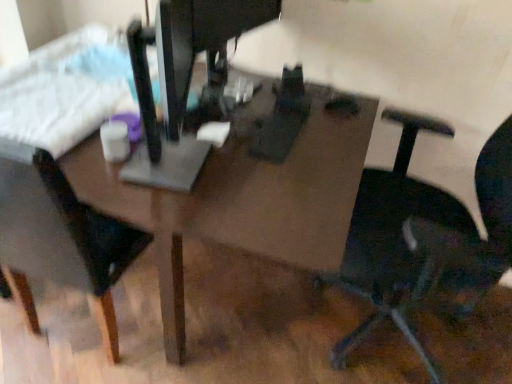
I want to click on vacant space to the right of metallic gray sewing machine at center, so click(285, 183).